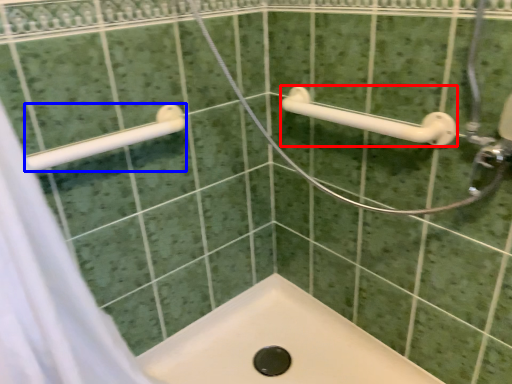
Question: Among these objects, which one is nearest to the camera, towel rack (highlighted by a red box) or towel rack (highlighted by a blue box)?

Choices:
 (A) towel rack
 (B) towel rack

Answer: (B)